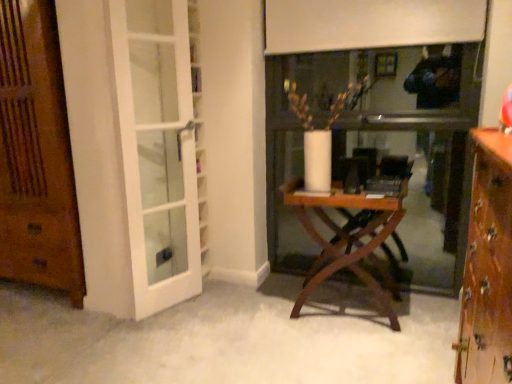
I want to click on free area below white glass door at left (from a real-world perspective), so click(x=173, y=301).